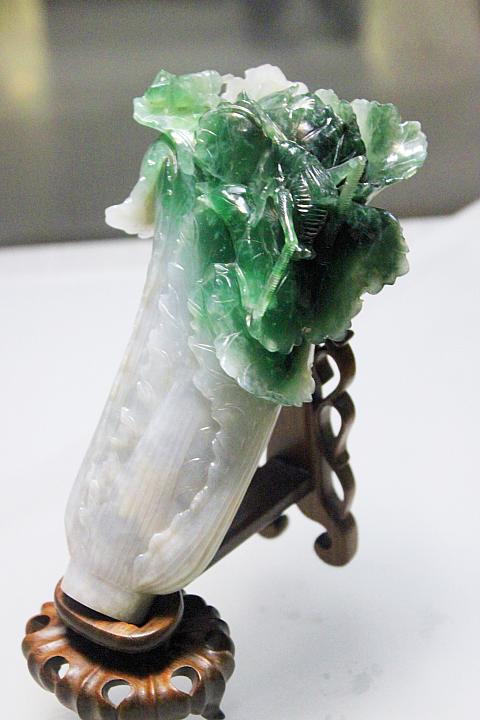
The height and width of the screenshot is (720, 480). What are the coordinates of `1 art glass fixture` in the screenshot? It's located at (192, 271).